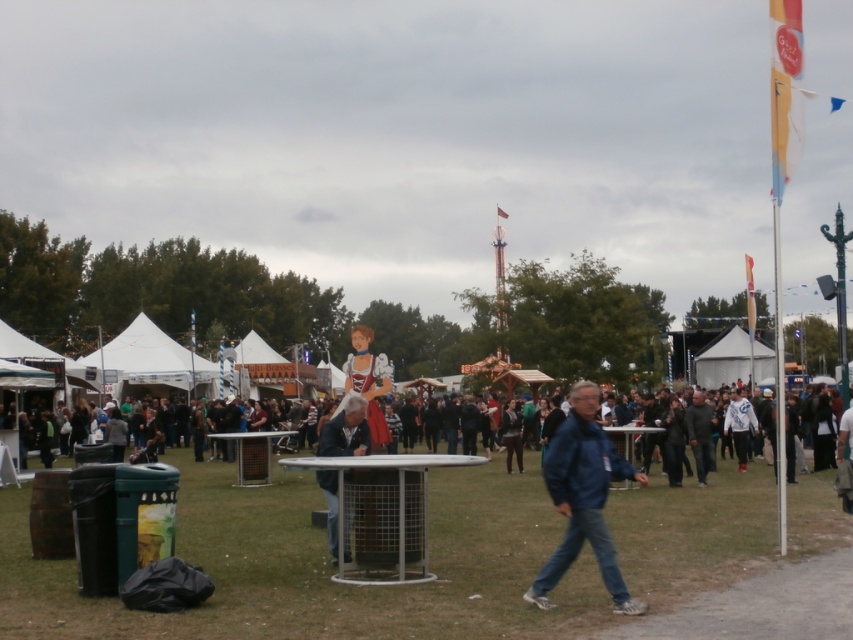
Is point (561, 474) behind point (712, 461)?

That is False.

The height and width of the screenshot is (640, 853). What do you see at coordinates (583, 499) in the screenshot? I see `blue denim jacket at center` at bounding box center [583, 499].

Identify the location of blue denim jacket at center. (583, 499).

Looking at this image, who is higher up, denim jacket at center or dark gray jacket at center?

denim jacket at center is above.

Can you confirm if denim jacket at center is wider than dark gray jacket at center?

In fact, denim jacket at center might be narrower than dark gray jacket at center.

Measure the distance between point (335, 438) and camera.

Point (335, 438) is 48.10 feet away from camera.

At what (x,y) coordinates should I click in order to perform the action: click on denim jacket at center. Please return your answer as a coordinate pair (x, y). Image resolution: width=853 pixels, height=640 pixels. Looking at the image, I should click on (345, 432).

Between blue denim jacket at center and denim jacket at center, which one appears on the right side from the viewer's perspective?

From the viewer's perspective, blue denim jacket at center appears more on the right side.

Describe the element at coordinates (583, 499) in the screenshot. This screenshot has width=853, height=640. I see `blue denim jacket at center` at that location.

Find the location of a particular element. The width and height of the screenshot is (853, 640). blue denim jacket at center is located at coordinates (583, 499).